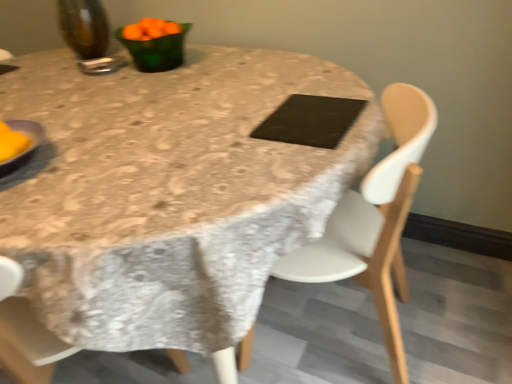
You are a GUI agent. You are given a task and a screenshot of the screen. Output one action in this format:
    pyautogui.click(x=<x>, y=<y>)
    Task: Click on the vacant area situated below metallic silver spoon at upper left, the first tableware from the left (from a real-world perspective)
    This screenshot has height=384, width=512.
    Given the screenshot: What is the action you would take?
    pyautogui.click(x=109, y=66)